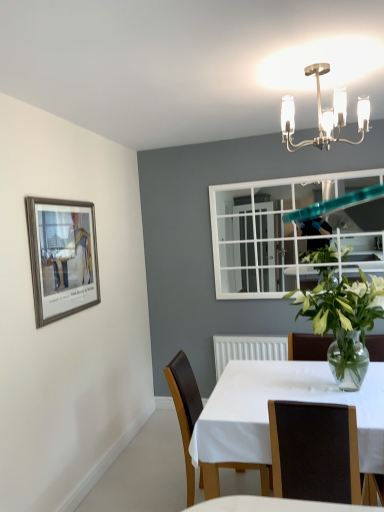
Locate an element on the screen. This screenshot has width=384, height=512. vacant area situated below clear glass vase at center (from a real-world perspective) is located at coordinates (326, 385).